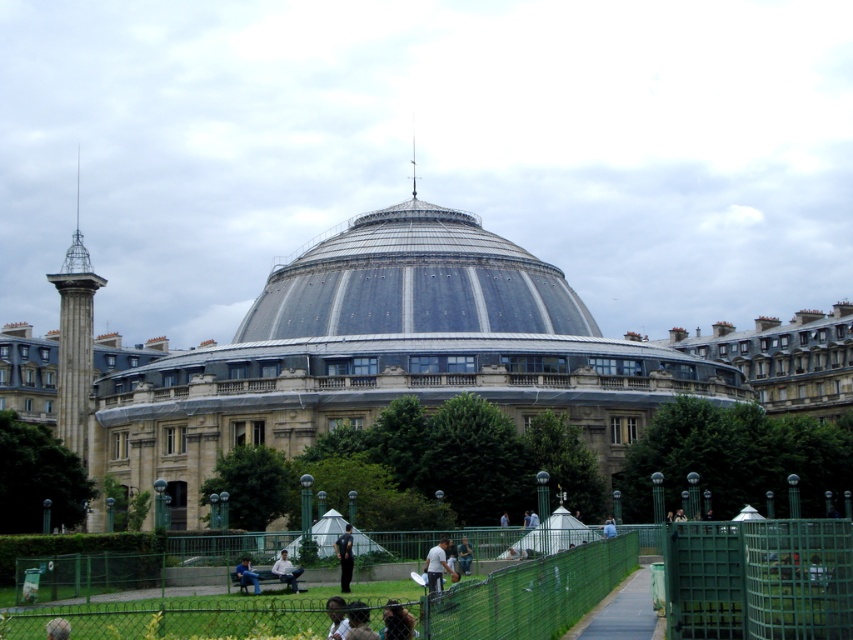
Question: Which object is positioned farthest from the wooden park bench at center?

Choices:
 (A) green wire mesh fence at lower center
 (B) dark hair at lower center

Answer: (B)

Question: Which of the following is the closest to the observer?

Choices:
 (A) (340, 602)
 (B) (10, 634)

Answer: (A)

Question: Which object is positioned closest to the green wire mesh fence at lower center?

Choices:
 (A) dark blue jeans at center
 (B) dark hair at lower center
 (C) stone dome at center

Answer: (B)

Question: Considering the relative positions of dark blue jeans at center and blue denim jeans at lower center in the image provided, where is dark blue jeans at center located with respect to blue denim jeans at lower center?

Choices:
 (A) left
 (B) right

Answer: (B)

Question: Considering the relative positions of stone dome at center and dark hair at lower center in the image provided, where is stone dome at center located with respect to dark hair at lower center?

Choices:
 (A) below
 (B) above

Answer: (B)

Question: Does dark gray asphalt path at center have a larger size compared to light brown skin at lower center?

Choices:
 (A) yes
 (B) no

Answer: (A)